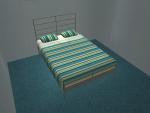
This screenshot has height=113, width=150. Find the location of `right pillow`. right pillow is located at coordinates (68, 33).